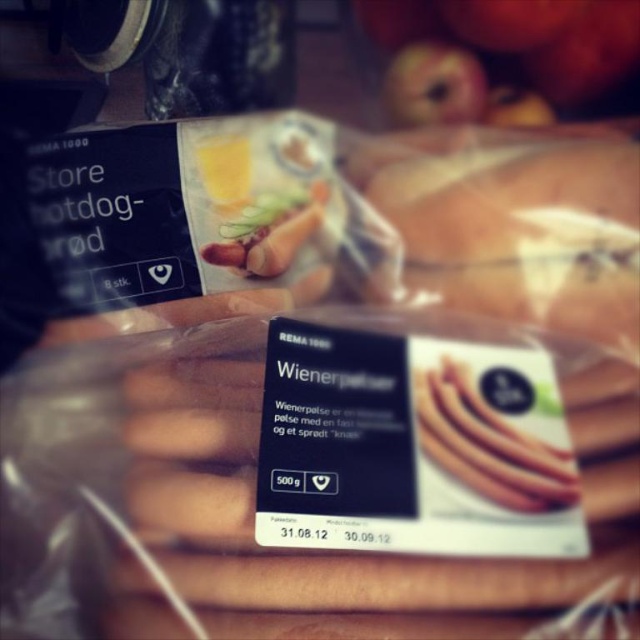
You are a grocery store employee arranging items on a shelf. You have a translucent plastic bag at center and a smooth red apple at upper center. Which item is located to the right of the other?

The translucent plastic bag at center is positioned on the right side of smooth red apple at upper center.

You are a customer at the grocery store and see the translucent plastic bag at center and the smooth red apple at upper center. Which object takes up more space in the image?

The translucent plastic bag at center is larger in size than the smooth red apple at upper center, so it takes up more space in the image.

What is the 2D coordinate of the translucent plastic bag at center?

The 2D coordinate of the translucent plastic bag at center is at point [524,230].